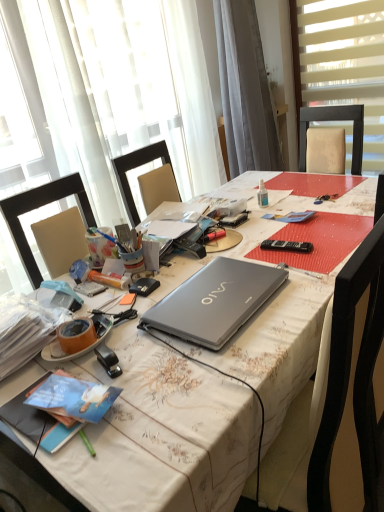
The height and width of the screenshot is (512, 384). Find the location of `free spot to the left of black plastic stapler at lower left`. free spot to the left of black plastic stapler at lower left is located at coordinates (50, 374).